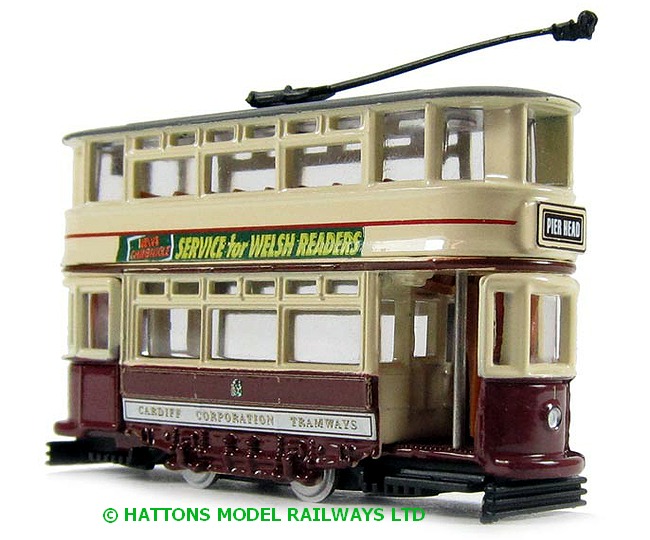
The height and width of the screenshot is (540, 650). I want to click on trolly, so click(254, 222).